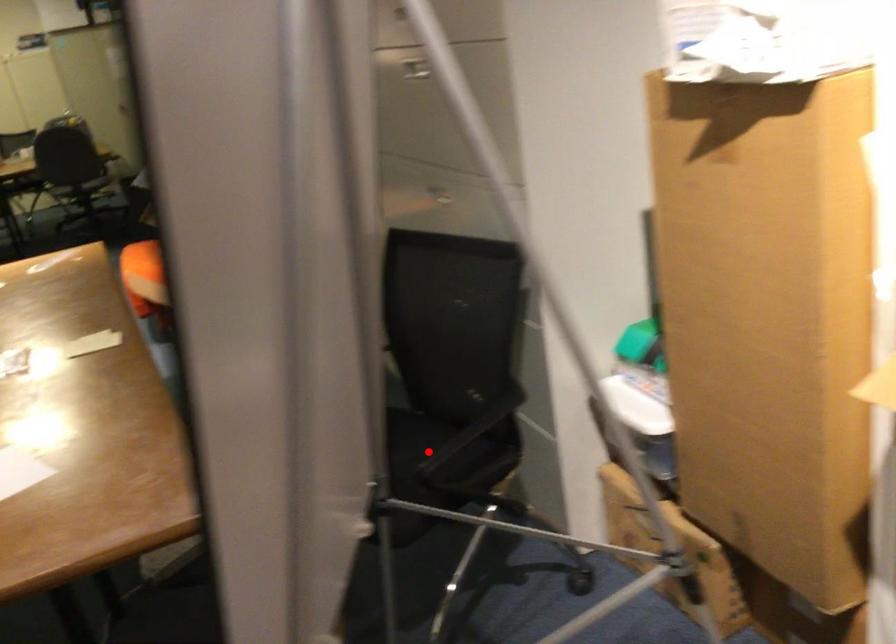
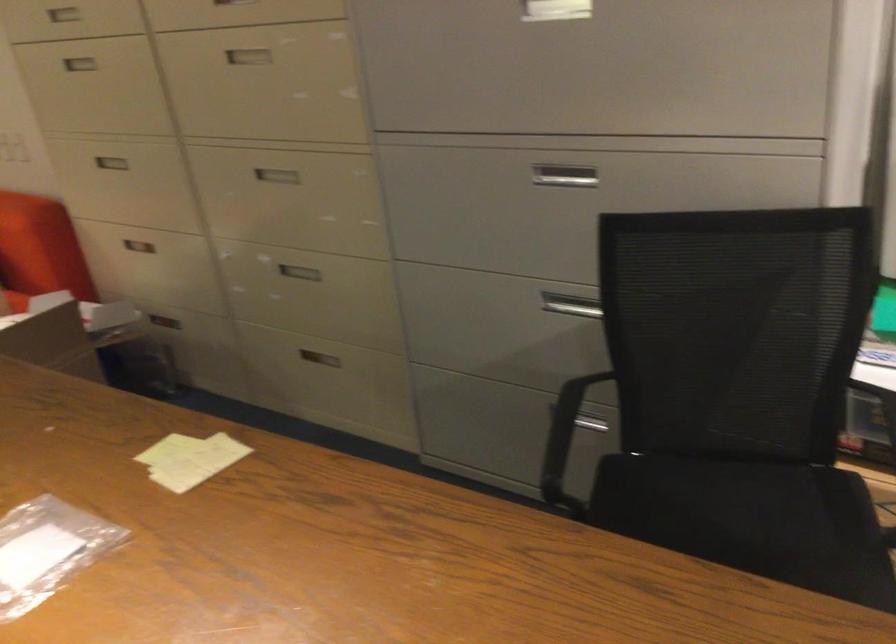
Where in the second image is the point corresponding to the highlighted location from the first image?

(739, 496)